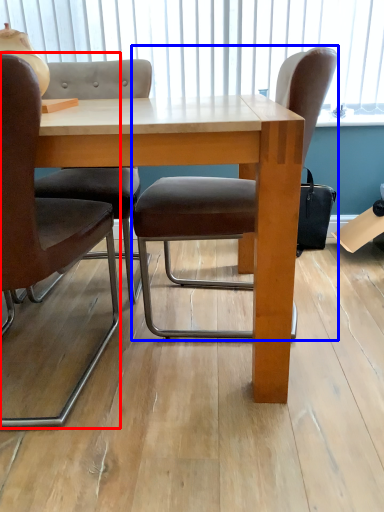
Question: Which object is closer to the camera taking this photo, chair (highlighted by a red box) or chair (highlighted by a blue box)?

Choices:
 (A) chair
 (B) chair

Answer: (A)